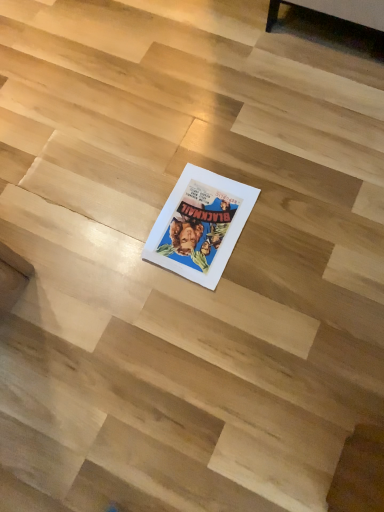
You are a GUI agent. You are given a task and a screenshot of the screen. Output one action in this format:
    pyautogui.click(x=<x>, y=<y>)
    Task: Click on the white paper book at center
    The image size is (384, 512).
    Given the screenshot: What is the action you would take?
    pyautogui.click(x=200, y=225)

Describe the element at coordinates (200, 225) in the screenshot. I see `white paper book at center` at that location.

This screenshot has height=512, width=384. Identify the location of white paper book at center. (200, 225).